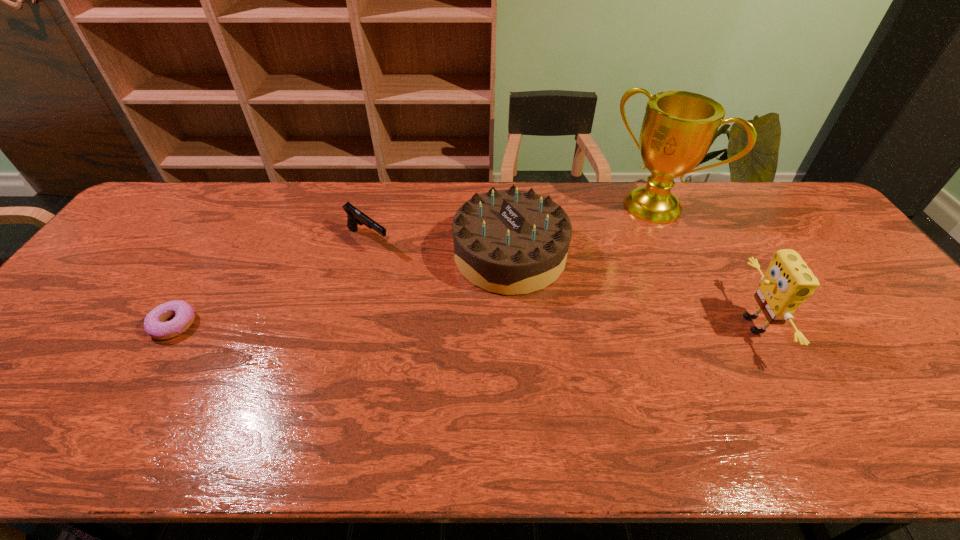
The image size is (960, 540). Find the location of `the leftmost object`. the leftmost object is located at coordinates (154, 324).

Locate an element on the screen. The width and height of the screenshot is (960, 540). the shortest object is located at coordinates (154, 324).

Image resolution: width=960 pixels, height=540 pixels. I want to click on sponge, so click(x=788, y=282).

This screenshot has width=960, height=540. In order to click on the third object from left to right in this screenshot , I will do (x=512, y=242).

Locate an element on the screen. This screenshot has height=540, width=960. the third tallest object is located at coordinates (512, 242).

I want to click on the fourth tallest object, so click(x=355, y=216).

You are a GUI agent. You are given a task and a screenshot of the screen. Output one action in this format:
    pyautogui.click(x=<x>, y=<y>)
    Task: Click on the gun
    
    Given the screenshot: What is the action you would take?
    pyautogui.click(x=355, y=216)

At what (x,y) coordinates should I click in order to perform the action: click on award. Please return your answer as a coordinate pair (x, y). The height and width of the screenshot is (540, 960). Looking at the image, I should click on (678, 128).

This screenshot has width=960, height=540. I want to click on vacant space located 0.170m on the front of the leftmost object, so click(x=124, y=407).

Where is `free space located on the face of the fourth shortest object`? The width and height of the screenshot is (960, 540). free space located on the face of the fourth shortest object is located at coordinates (681, 325).